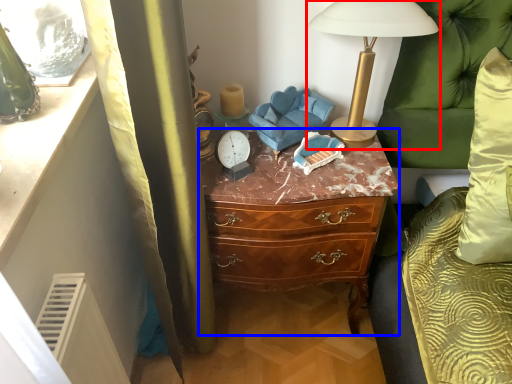
Question: Which point is further to the camera, lamp (highlighted by a red box) or chest of drawers (highlighted by a blue box)?

Choices:
 (A) lamp
 (B) chest of drawers

Answer: (B)